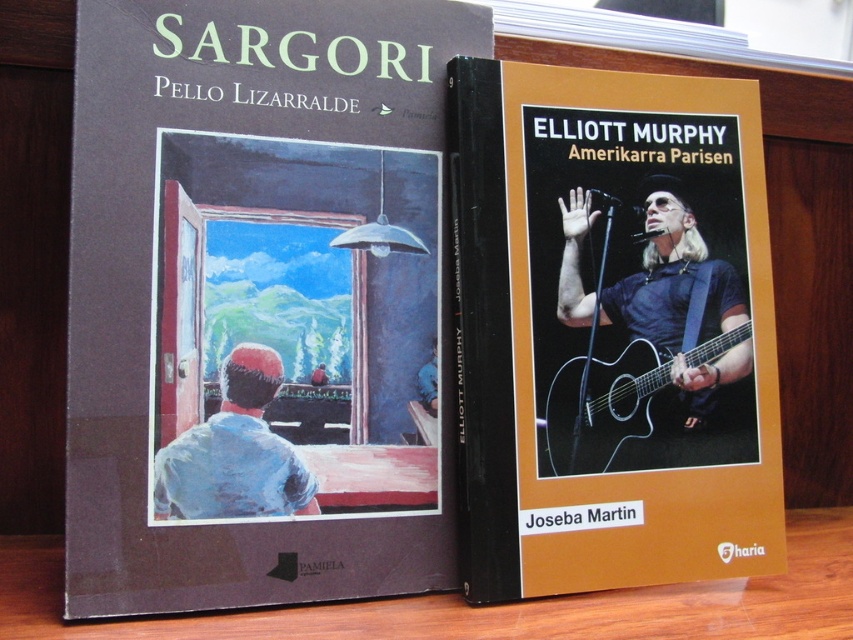
Question: Does matte brown book cover at left appear on the left side of matte black guitar at center?

Choices:
 (A) no
 (B) yes

Answer: (B)

Question: Which object appears closest to the camera in this image?

Choices:
 (A) acoustic wood guitar at center
 (B) matte black guitar at center
 (C) matte brown book cover at left

Answer: (C)

Question: Is matte black guitar at center closer to camera compared to acoustic wood guitar at center?

Choices:
 (A) no
 (B) yes

Answer: (B)

Question: Which point is farther to the camera?

Choices:
 (A) (511, 492)
 (B) (192, 604)
 (C) (589, 451)

Answer: (C)

Question: Estimate the real-world distances between objects in this image. Which object is closer to the matte brown book cover at left?

Choices:
 (A) matte black guitar at center
 (B) acoustic wood guitar at center

Answer: (A)

Question: Does matte brown book cover at left lie behind matte black guitar at center?

Choices:
 (A) no
 (B) yes

Answer: (A)